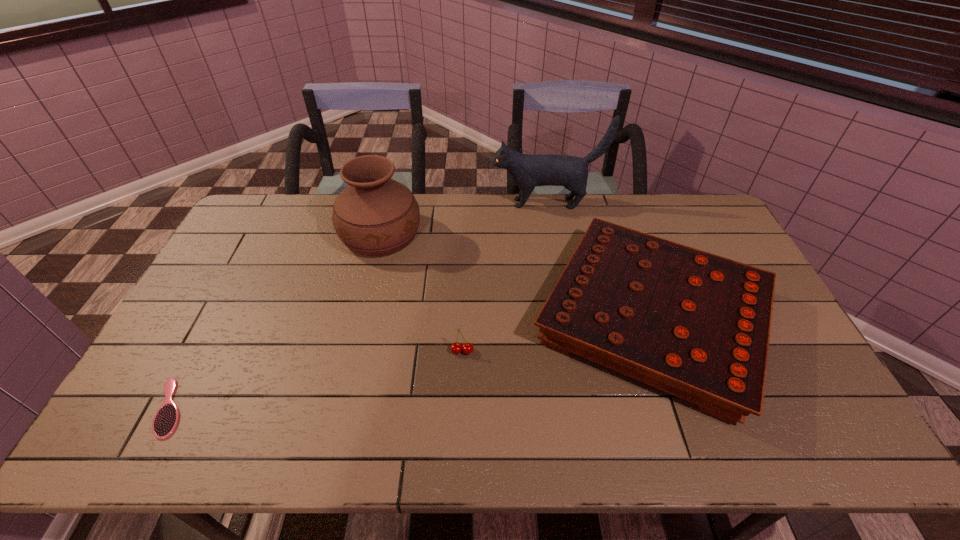
I want to click on object located in the right edge section of the desktop, so click(696, 325).

The width and height of the screenshot is (960, 540). I want to click on object that is at the near left corner, so click(166, 419).

Locate an element on the screen. The image size is (960, 540). object at the near right corner is located at coordinates (696, 325).

At what (x,y) coordinates should I click in order to perform the action: click on vacant area at the far edge. Please return your answer as a coordinate pair (x, y). Looking at the image, I should click on (639, 210).

In the image, there is a desktop. Where is `free space at the near edge`? The width and height of the screenshot is (960, 540). free space at the near edge is located at coordinates (639, 440).

In the image, there is a desktop. Identify the location of vacant space at the left edge. (218, 354).

The image size is (960, 540). I want to click on vacant space at the near left corner of the desktop, so click(134, 426).

Identify the location of free space between the gameboard and the leftmost object. This screenshot has height=540, width=960. (411, 363).

Image resolution: width=960 pixels, height=540 pixels. What are the coordinates of `free space that is in between the leftmost object and the third object from left to right` in the screenshot? It's located at (316, 379).

You are a GUI agent. You are given a task and a screenshot of the screen. Output one action in this format:
    pyautogui.click(x=<x>, y=<y>)
    Task: Click on the free spot between the shortest object and the gameboard
    
    Given the screenshot: What is the action you would take?
    pyautogui.click(x=411, y=363)